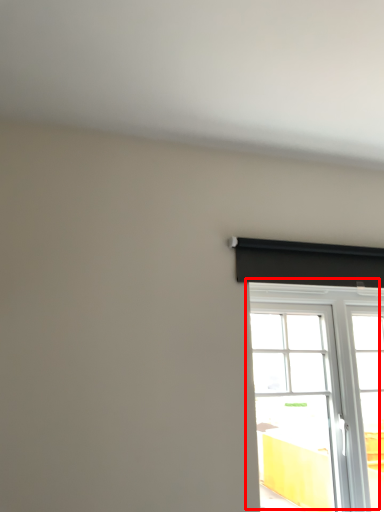
Question: Considering the relative positions of window (annotated by the red box) and curtain in the image provided, where is window (annotated by the red box) located with respect to the staircase?

Choices:
 (A) left
 (B) right

Answer: (B)